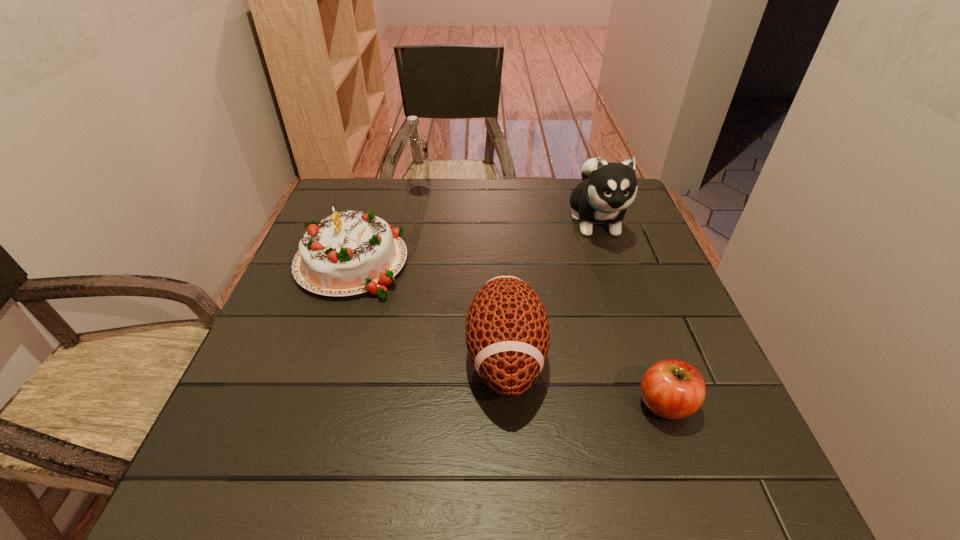
The width and height of the screenshot is (960, 540). Find the location of `free space between the cake and the puppy`. free space between the cake and the puppy is located at coordinates (473, 241).

Identify the location of free spot between the puppy and the cake. The height and width of the screenshot is (540, 960). (473, 241).

Identify which object is the nearest to the vodka. Please provide its 2D coordinates. Your answer should be formatted as a tuple, i.e. [(x, y)], where the tuple contains the x and y coordinates of a point satisfying the conditions above.

[(348, 253)]

The image size is (960, 540). What are the coordinates of `object that stands as the second closest to the cake` in the screenshot? It's located at (415, 147).

You are a GUI agent. You are given a task and a screenshot of the screen. Output one action in this format:
    pyautogui.click(x=<x>, y=<y>)
    Task: Click on the vacant position in the image that satisfies the following two spatial constraints: 1. on the front label of the vodka; 2. on the left side of the apple
    The width and height of the screenshot is (960, 540).
    Given the screenshot: What is the action you would take?
    pyautogui.click(x=378, y=403)

This screenshot has width=960, height=540. In order to click on free region that satisfies the following two spatial constraints: 1. on the front label of the apple; 2. on the right side of the vodka in this screenshot , I will do `click(378, 403)`.

Locate an element on the screen. The image size is (960, 540). vacant space that satisfies the following two spatial constraints: 1. on the back side of the apple; 2. on the front label of the vodka is located at coordinates (590, 191).

Find the location of a particular element. free location that satisfies the following two spatial constraints: 1. on the front side of the cake; 2. on the right side of the third object from left to right is located at coordinates (320, 356).

Identify the location of vacant region that satisfies the following two spatial constraints: 1. on the front label of the vodka; 2. on the left side of the football. The height and width of the screenshot is (540, 960). (388, 356).